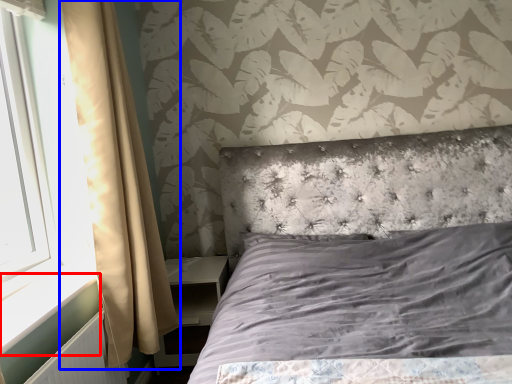
Question: Which object is further to the camera taking this photo, window sill (highlighted by a red box) or curtain (highlighted by a blue box)?

Choices:
 (A) window sill
 (B) curtain

Answer: (B)